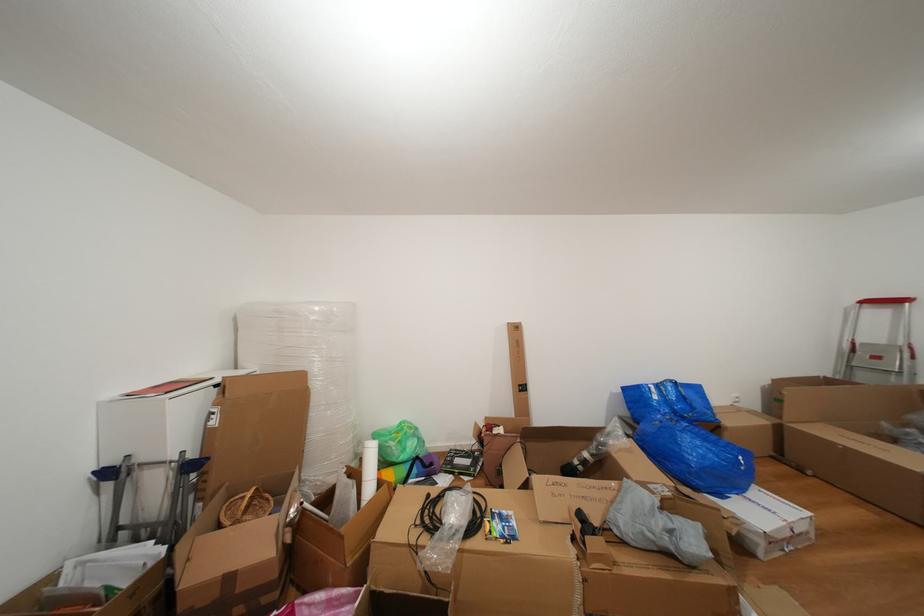
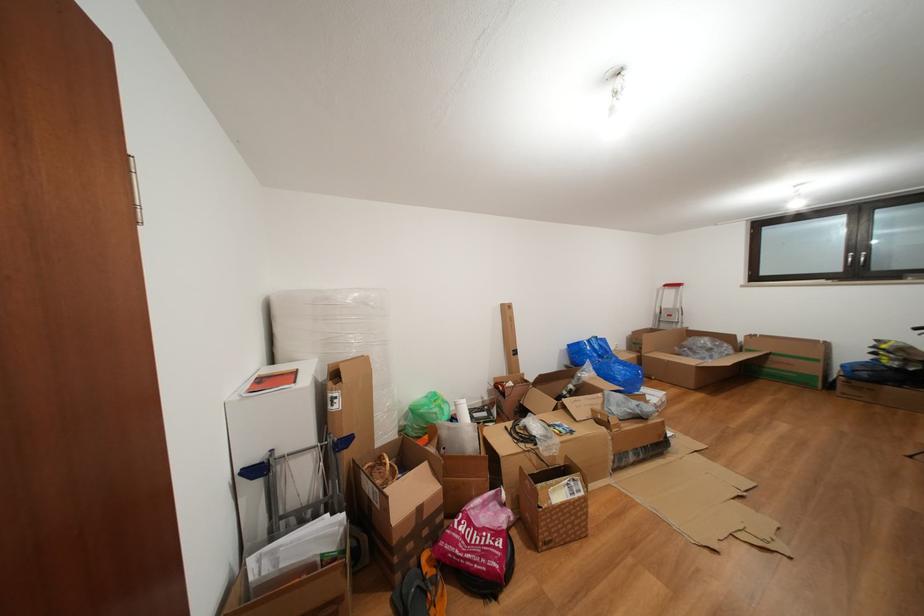
The point at (872, 307) is marked in the first image. Where is the corresponding point in the second image?

(674, 291)